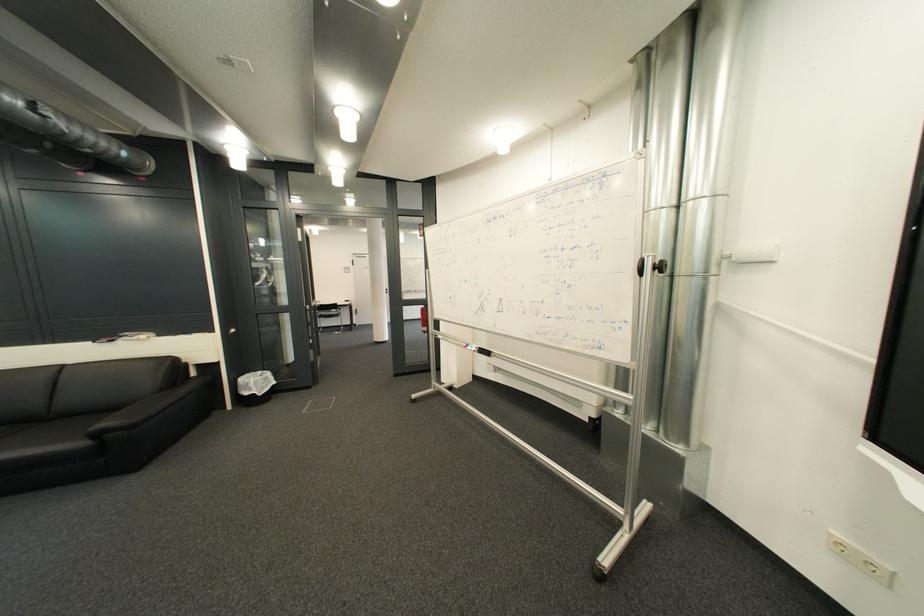
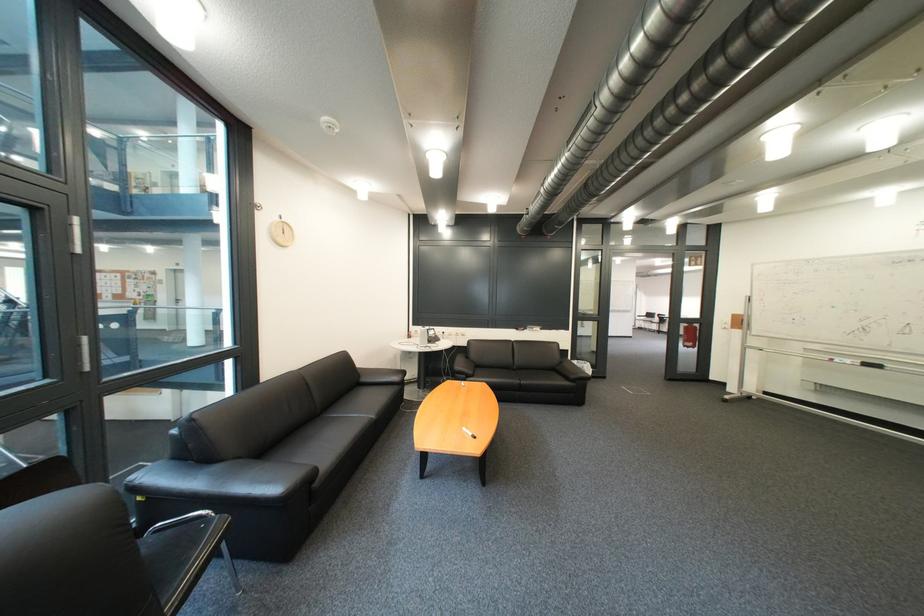
In a continuous first-person perspective shot, in which direction is the camera moving?

The cameraman walked toward left, backward.